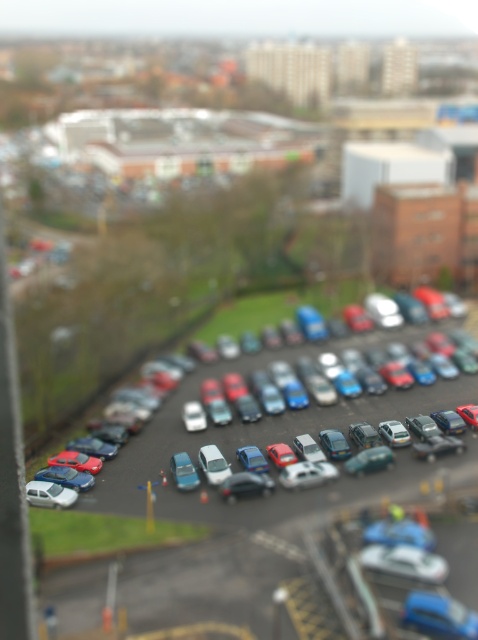
You are standing at the edge of the parking lot and see the matte silver car at center and the metallic silver car at center. Which car is closer to you?

The matte silver car at center is positioned over the metallic silver car at center, so it is closer to you.

You are a delivery person trying to park your van which is 1.8 meters tall. You see the metallic silver cars at center and the matte silver car at center in the parking lot. Which of these two cars can your van safely pass under without hitting the roof?

The matte silver car at center is shorter than the metallic silver cars at center. Since your van is 1.8 meters tall, you need to ensure there is enough clearance. The metallic silver cars at center are much taller, so passing under them would likely be safe. However, the matte silver car at center is shorter, so there might not be enough clearance. Therefore, the safest option is to go under the metallic silver cars at center.

You are a parking attendant trying to fit a new car into the parking lot. You notice two silver cars at the center. The metallic silver cars at center and the matte silver car at center. Which one is bigger?

The metallic silver cars at center is larger than the matte silver car at center according to the description.